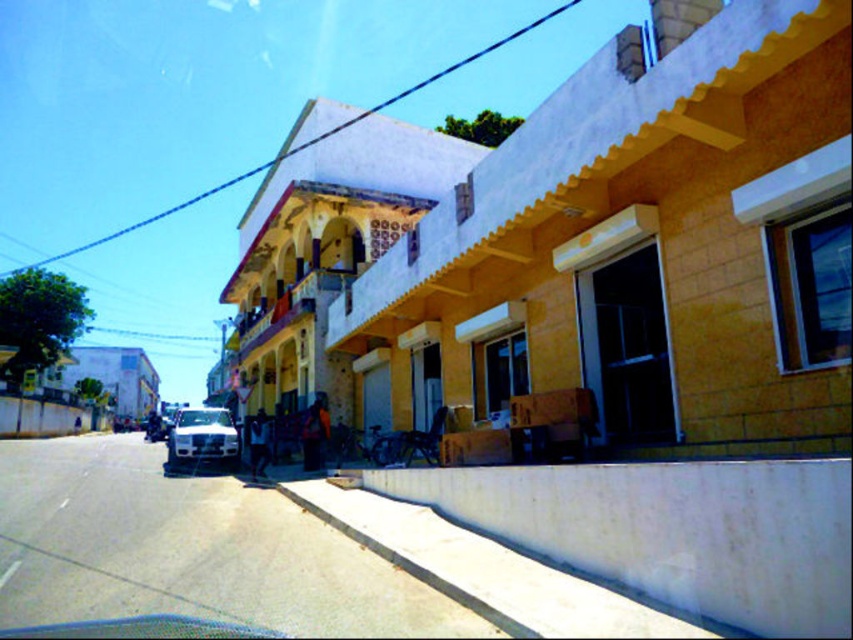
Question: Which is nearer to the white glossy car at center?

Choices:
 (A) white concrete curb at lower center
 (B) shiny silver motorcycle at center

Answer: (B)

Question: Among these points, which one is farthest from the camera?

Choices:
 (A) (830, 477)
 (B) (164, 419)

Answer: (B)

Question: Considering the relative positions of white concrete curb at lower center and shiny silver motorcycle at center in the image provided, where is white concrete curb at lower center located with respect to shiny silver motorcycle at center?

Choices:
 (A) left
 (B) right

Answer: (B)

Question: Which object is positioned farthest from the white concrete curb at lower center?

Choices:
 (A) shiny silver motorcycle at center
 (B) white glossy car at center

Answer: (A)

Question: Where is white glossy car at center located in relation to shiny silver motorcycle at center in the image?

Choices:
 (A) left
 (B) right

Answer: (B)

Question: Can you confirm if white concrete curb at lower center is thinner than white glossy car at center?

Choices:
 (A) yes
 (B) no

Answer: (A)